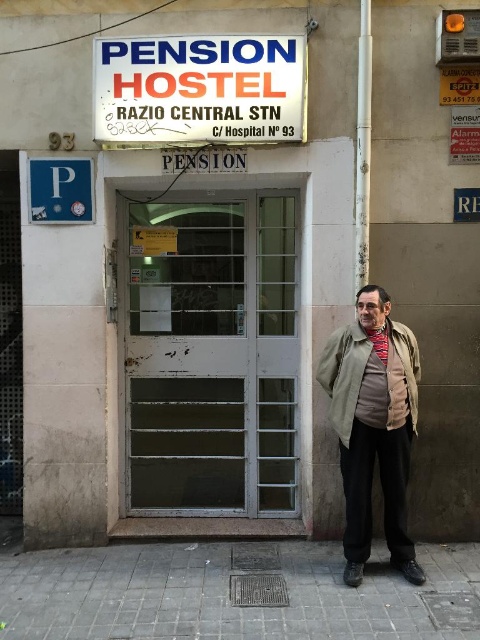
Between white plastic sign at upper center and blue plastic parking sign at upper left, which one has less height?

blue plastic parking sign at upper left

Which is above, white plastic sign at upper center or blue plastic parking sign at upper left?

Positioned higher is white plastic sign at upper center.

Where is `white plastic sign at upper center`? Image resolution: width=480 pixels, height=640 pixels. white plastic sign at upper center is located at coordinates (200, 90).

Can you confirm if khaki fabric jacket at center is taller than olive green fabric trench coat at center?

Correct, khaki fabric jacket at center is much taller as olive green fabric trench coat at center.

Does khaki fabric jacket at center appear on the left side of olive green fabric trench coat at center?

Incorrect, khaki fabric jacket at center is not on the left side of olive green fabric trench coat at center.

Who is more distant from viewer, [348,364] or [338,362]?

The point [338,362] is more distant.

At what (x,y) coordinates should I click in order to perform the action: click on khaki fabric jacket at center. Please return your answer as a coordinate pair (x, y). Looking at the image, I should click on (373, 428).

Is white plastic sign at upper center bigger than striped wool scarf at center?

Indeed, white plastic sign at upper center has a larger size compared to striped wool scarf at center.

Measure the distance from white plastic sign at upper center to striped wool scarf at center.

white plastic sign at upper center and striped wool scarf at center are 1.64 meters apart.

Identify the location of white plastic sign at upper center. The image size is (480, 640). (200, 90).